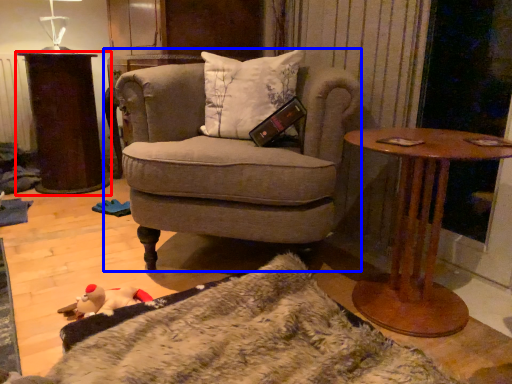
Question: Which point is closer to the camera, table (highlighted by a red box) or chair (highlighted by a blue box)?

Choices:
 (A) table
 (B) chair

Answer: (B)